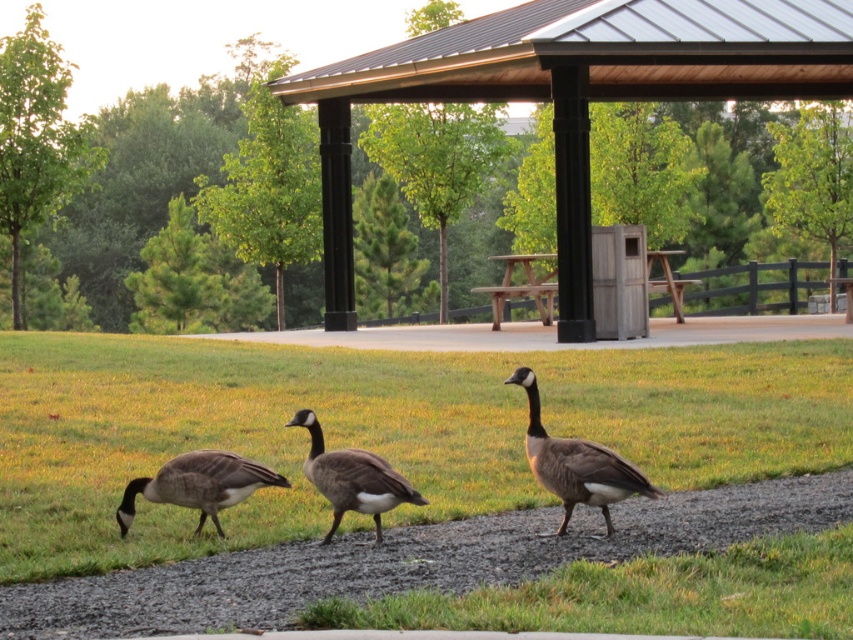
You are standing in the park and see the green grass at lower center and the brown matte duck at lower left. Which object is nearer to you?

The green grass at lower center is closer to the viewer than the brown matte duck at lower left.

You are standing at the camera position and want to take a photo of the brown matte duck at center. If your camera has a maximum focus range of 10 meters, will you be able to capture the duck clearly?

The brown matte duck at center and camera are 10.46 meters apart from each other, so the distance exceeds the camera maximum focus range of 10 meters. Therefore, you will not be able to capture the duck clearly.

You are a park visitor who wants to place a small birdhouse exactly halfway between the brown matte duck at center and the brown wood picnic table at center. Given that the duck is shorter than the picnic table, where should you position the birdhouse so it is equidistant from both objects?

The birdhouse should be placed at the midpoint between the brown matte duck at center and the brown wood picnic table at center, ensuring it is equidistant from both objects horizontally and vertically. Since the duck is shorter, the vertical positioning doesn